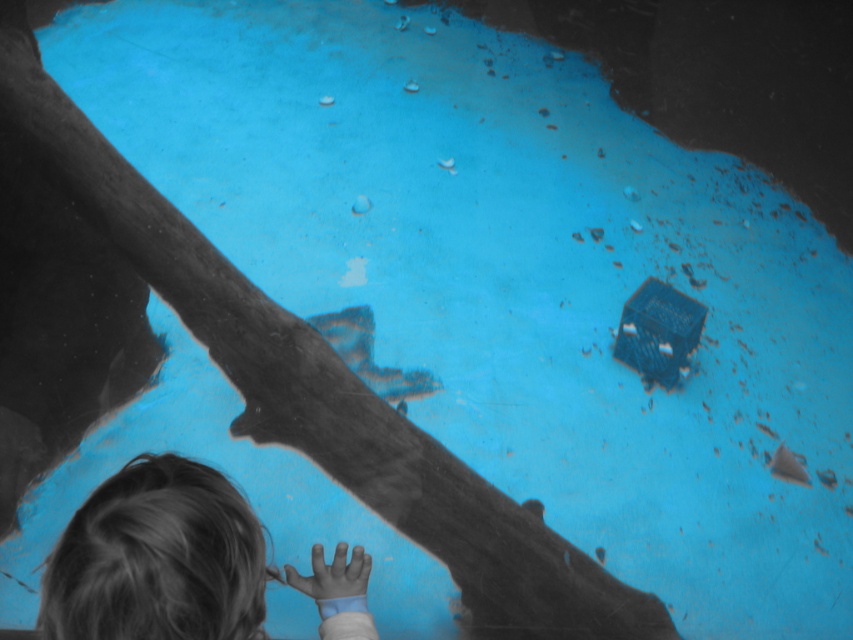
Who is positioned more to the left, blonde hair at lower left or smooth skin hand at lower center?

blonde hair at lower left

Can you confirm if blonde hair at lower left is positioned to the left of smooth skin hand at lower center?

Correct, you'll find blonde hair at lower left to the left of smooth skin hand at lower center.

What are the coordinates of `blonde hair at lower left` in the screenshot? It's located at (158, 560).

Where is `blonde hair at lower left`? blonde hair at lower left is located at coordinates click(158, 560).